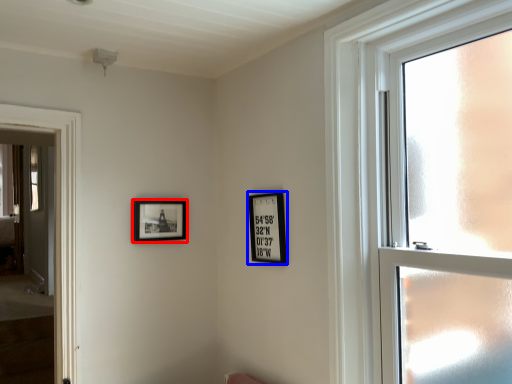
Question: Which of the following is the closest to the observer, picture frame (highlighted by a red box) or picture frame (highlighted by a blue box)?

Choices:
 (A) picture frame
 (B) picture frame

Answer: (B)